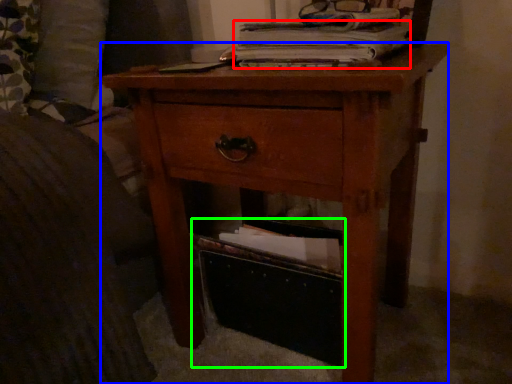
Question: Which object is positioned farthest from paperback book (highlighted by a red box)? Select from nightstand (highlighted by a blue box) and storage box (highlighted by a green box).

Choices:
 (A) nightstand
 (B) storage box

Answer: (B)